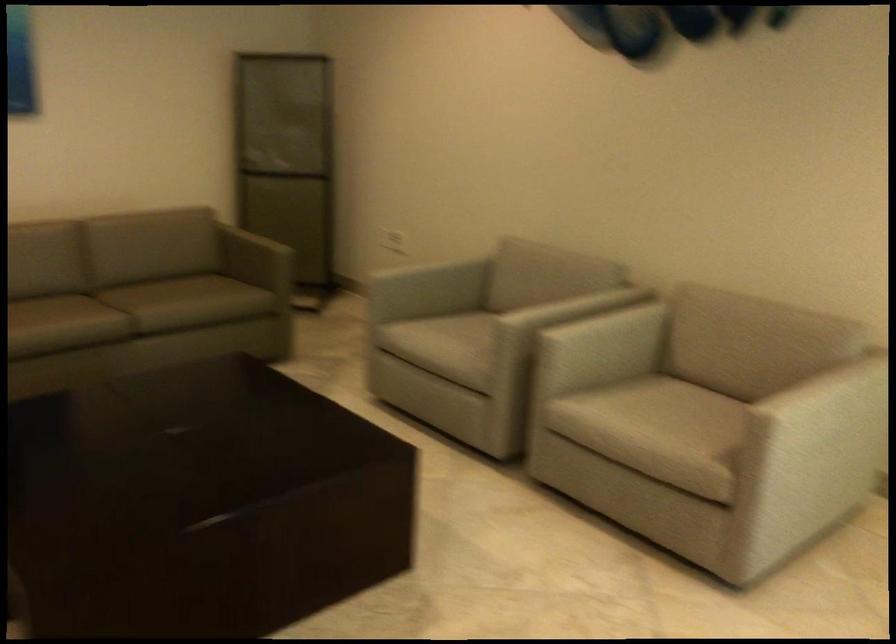
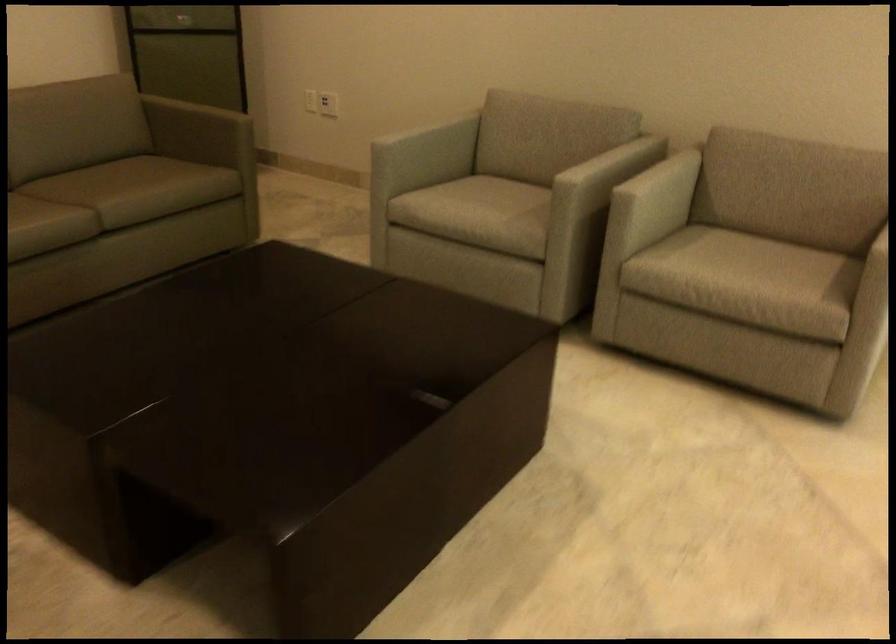
In the second image, find the point that corresponds to point (177, 301) in the first image.

(145, 187)